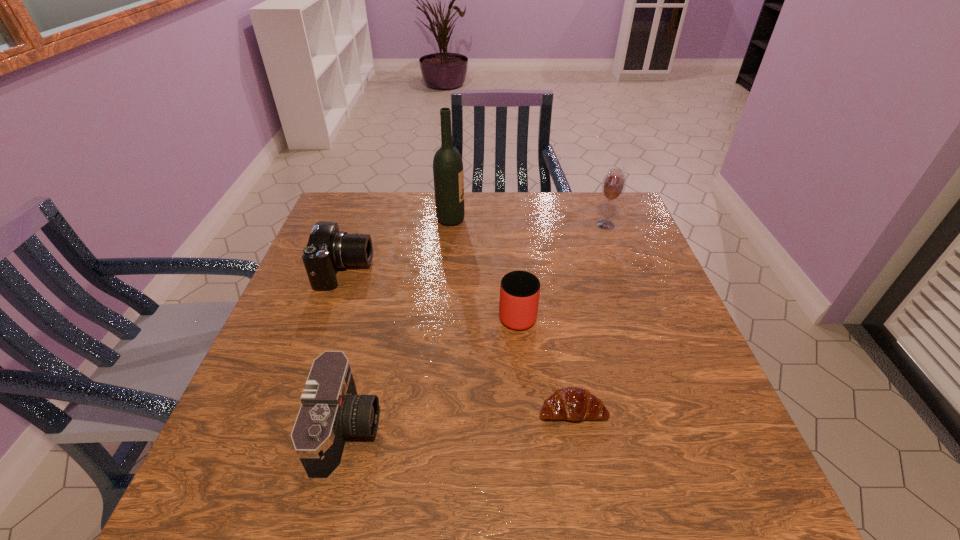
This screenshot has height=540, width=960. In order to click on vacant region located 0.130m on the lens of the farther camera in this screenshot , I will do `click(419, 271)`.

The image size is (960, 540). Identify the location of free region located 0.220m on the handle side of the cup. (511, 242).

Where is `free space located on the handle side of the cup`? This screenshot has width=960, height=540. free space located on the handle side of the cup is located at coordinates (509, 215).

Identify the location of vacant space located 0.330m on the handle side of the cup. The image size is (960, 540). (509, 221).

At what (x,y) coordinates should I click in order to perform the action: click on vacant area situated 0.080m on the front-facing side of the nearer camera. Please return your answer as a coordinate pair (x, y). Image resolution: width=960 pixels, height=540 pixels. Looking at the image, I should click on (421, 429).

The width and height of the screenshot is (960, 540). I want to click on vacant space located on the left of the crescent roll, so click(x=496, y=409).

Where is `wine bottle that is at the far edge`? This screenshot has height=540, width=960. wine bottle that is at the far edge is located at coordinates (448, 174).

You are a GUI agent. You are given a task and a screenshot of the screen. Output one action in this format:
    pyautogui.click(x=<x>, y=<y>)
    Task: Click on the wineglass located at the far edge
    This screenshot has height=540, width=960.
    Given the screenshot: What is the action you would take?
    pyautogui.click(x=613, y=186)

Identify the location of object present at the near edge. (331, 410).

At what (x,y) coordinates should I click in order to perform the action: click on object positioned at the left edge. Please return your answer as a coordinate pair (x, y). Image resolution: width=960 pixels, height=540 pixels. Looking at the image, I should click on (328, 249).